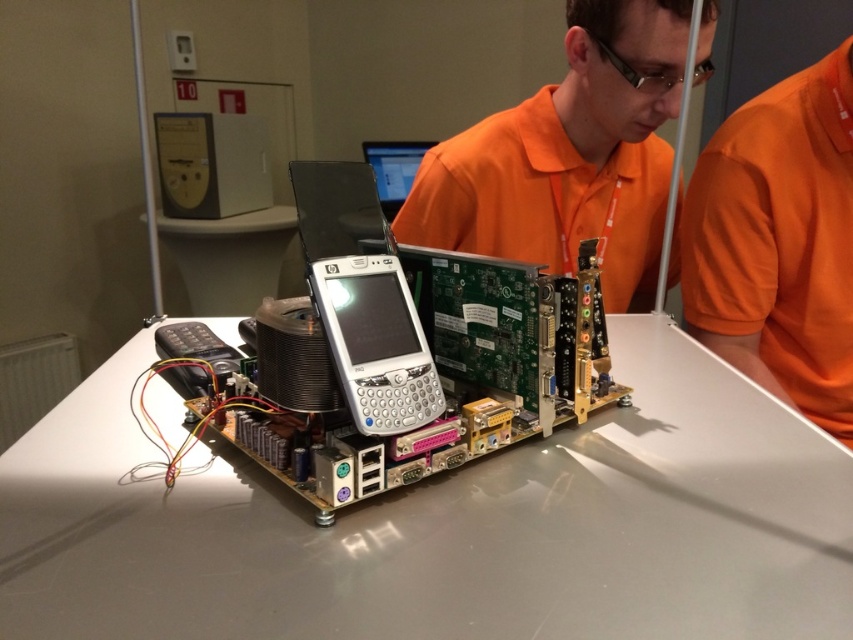
Between orange fabric shirt at upper center and orange fabric shirt at upper right, which one is positioned lower?

orange fabric shirt at upper right is lower down.

Consider the image. Does orange fabric shirt at upper center have a smaller size compared to orange fabric shirt at upper right?

No.

Measure the distance between orange fabric shirt at upper center and camera.

They are 3.42 feet apart.

The height and width of the screenshot is (640, 853). I want to click on orange fabric shirt at upper center, so click(x=567, y=156).

Between point (614, 364) and point (515, 243), which one is positioned in front?

Point (614, 364)

Is white glossy table at center below orange fabric shirt at upper center?

Yes.

You are a GUI agent. You are given a task and a screenshot of the screen. Output one action in this format:
    pyautogui.click(x=<x>, y=<y>)
    Task: Click on the white glossy table at center
    Image resolution: width=853 pixels, height=640 pixels.
    Given the screenshot: What is the action you would take?
    tap(445, 525)

Which is more to the left, white glossy table at center or orange fabric shirt at upper right?

white glossy table at center

Is point (308, 596) closer to camera compared to point (827, 177)?

That is True.

The height and width of the screenshot is (640, 853). Describe the element at coordinates (445, 525) in the screenshot. I see `white glossy table at center` at that location.

At what (x,y) coordinates should I click in order to perform the action: click on white glossy table at center. Please return your answer as a coordinate pair (x, y). The width and height of the screenshot is (853, 640). Looking at the image, I should click on (445, 525).